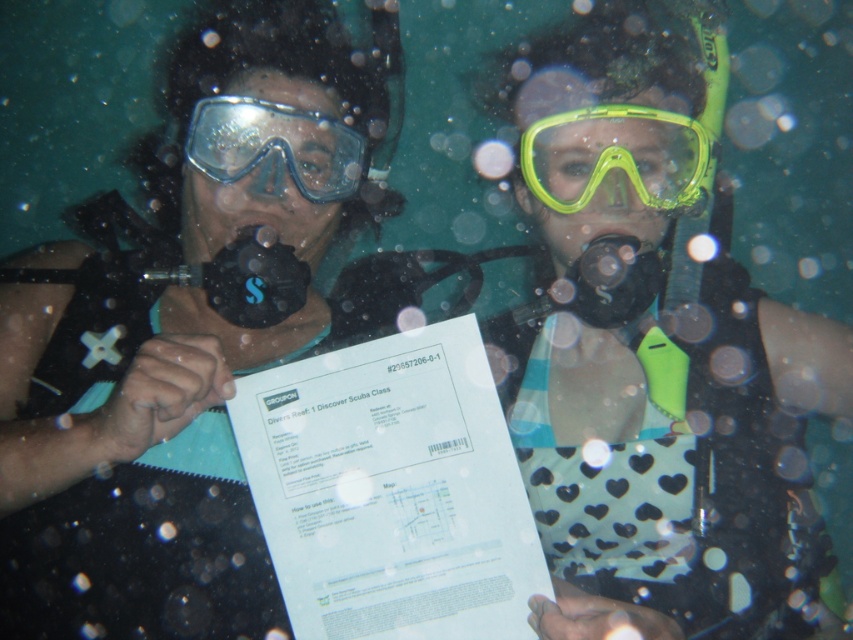
Which is more to the right, matte black wetsuit at left or transparent plastic goggles at upper center?

transparent plastic goggles at upper center

Who is positioned more to the left, matte black wetsuit at left or transparent plastic goggles at upper center?

From the viewer's perspective, matte black wetsuit at left appears more on the left side.

This screenshot has width=853, height=640. In order to click on matte black wetsuit at left in this screenshot , I will do `click(198, 253)`.

Can you confirm if matte black wetsuit at left is thinner than yellow matte/glossy goggles at center?

No.

Is point (372, 128) positioned in front of point (688, 177)?

No, it is behind (688, 177).

This screenshot has height=640, width=853. Describe the element at coordinates (198, 253) in the screenshot. I see `matte black wetsuit at left` at that location.

Where is `matte black wetsuit at left`? This screenshot has height=640, width=853. matte black wetsuit at left is located at coordinates (198, 253).

Can you confirm if yellow matte/glossy goggles at center is wider than transparent plastic goggles at upper center?

Indeed, yellow matte/glossy goggles at center has a greater width compared to transparent plastic goggles at upper center.

Can you confirm if yellow matte/glossy goggles at center is thinner than transparent plastic goggles at upper center?

Incorrect, yellow matte/glossy goggles at center's width is not less than transparent plastic goggles at upper center's.

Between point (543, 186) and point (231, 115), which one is positioned in front?

Point (231, 115)

Locate an element on the screen. The image size is (853, 640). yellow matte/glossy goggles at center is located at coordinates (618, 156).